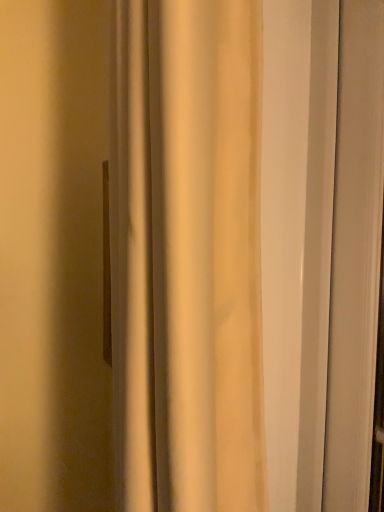
Where is `matte yellow curtain at center`? The height and width of the screenshot is (512, 384). matte yellow curtain at center is located at coordinates (186, 256).

This screenshot has height=512, width=384. Describe the element at coordinates (186, 256) in the screenshot. I see `matte yellow curtain at center` at that location.

The height and width of the screenshot is (512, 384). I want to click on matte yellow curtain at center, so click(x=186, y=256).